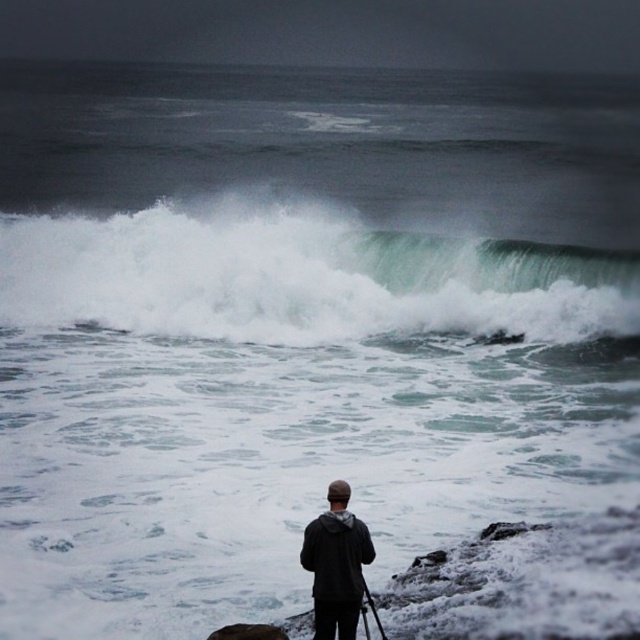
You are a hiker standing on the rocky terrain in the coastal scene. You see the white frothy wave at upper center and the dark gray hoodie at center. Which object is closer to you?

The white frothy wave at upper center is closer to you because it is further to the viewer than the dark gray hoodie at center.

You are a photographer trying to capture the dramatic waves. You have a black matte tripod at lower center and see the white frothy wave at upper center. Which object is bigger in the image?

The white frothy wave at upper center is larger in size than the black matte tripod at lower center.